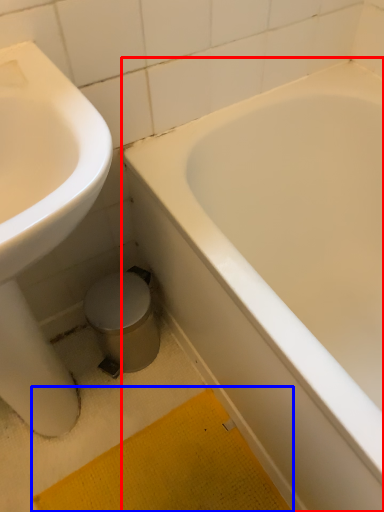
Question: Which of the following is the farthest to the observer, bathtub (highlighted by a red box) or bath mat (highlighted by a blue box)?

Choices:
 (A) bathtub
 (B) bath mat

Answer: (B)